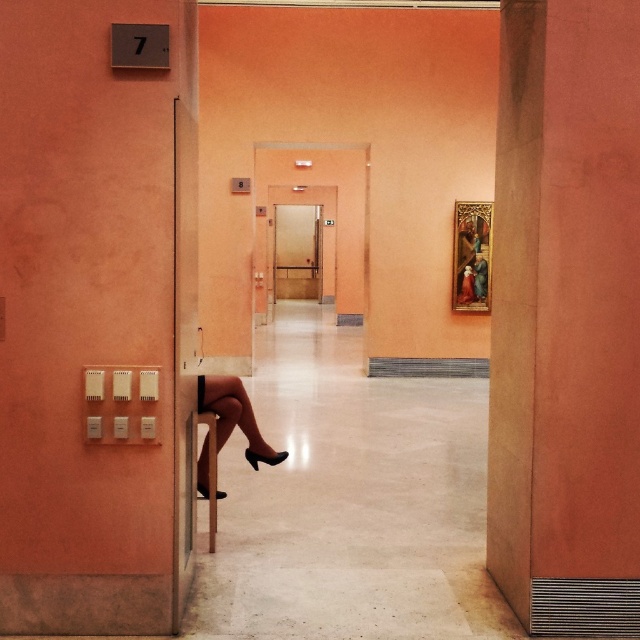
Between smooth orange wall at center and matte black legs at lower left, which one appears on the right side from the viewer's perspective?

smooth orange wall at center is more to the right.

Which is behind, point (632, 472) or point (276, 454)?

Point (276, 454)

Is point (588, 173) farther from camera compared to point (280, 456)?

No, (588, 173) is closer to viewer.

At what (x,y) coordinates should I click in order to perform the action: click on smooth orange wall at center. Please return your answer as a coordinate pair (x, y). This screenshot has height=640, width=640. Looking at the image, I should click on [x=566, y=317].

Based on the photo, is smooth orange wall at center to the right of metallic elevator at center from the viewer's perspective?

Correct, you'll find smooth orange wall at center to the right of metallic elevator at center.

Which of these two, smooth orange wall at center or metallic elevator at center, stands taller?

With more height is smooth orange wall at center.

Is point (497, 362) positioned after point (307, 211)?

No.

Identify the location of smooth orange wall at center. (566, 317).

Does metallic elevator at center appear on the left side of matte black legs at lower left?

Indeed, metallic elevator at center is positioned on the left side of matte black legs at lower left.

Is metallic elevator at center taller than matte black legs at lower left?

Indeed, metallic elevator at center has a greater height compared to matte black legs at lower left.

Who is more distant from viewer, (x=316, y=256) or (x=220, y=420)?

The point (x=316, y=256) is more distant.

Locate an element on the screen. The image size is (640, 640). metallic elevator at center is located at coordinates (298, 252).